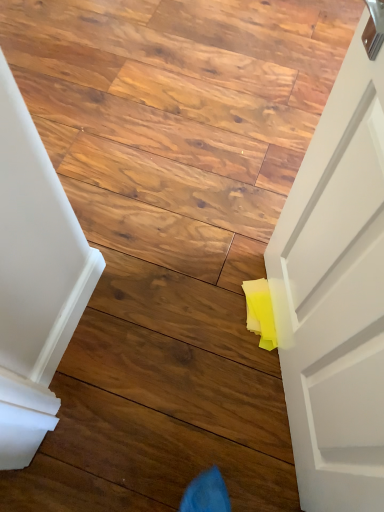
Question: From the image's perspective, is smooth wood plank at center positioned above or below yellow paper at lower right?

Choices:
 (A) above
 (B) below

Answer: (B)

Question: Is smooth wood plank at center in front of or behind yellow paper at lower right in the image?

Choices:
 (A) front
 (B) behind

Answer: (A)

Question: Do you think smooth wood plank at center is within yellow paper at lower right, or outside of it?

Choices:
 (A) outside
 (B) inside

Answer: (A)

Question: In terms of width, does yellow paper at lower right look wider or thinner when compared to smooth wood plank at center?

Choices:
 (A) thin
 (B) wide

Answer: (B)

Question: Is yellow paper at lower right bigger or smaller than smooth wood plank at center?

Choices:
 (A) small
 (B) big

Answer: (B)

Question: In the image, is yellow paper at lower right positioned in front of or behind smooth wood plank at center?

Choices:
 (A) front
 (B) behind

Answer: (B)

Question: Is yellow paper at lower right spatially inside smooth wood plank at center, or outside of it?

Choices:
 (A) inside
 (B) outside

Answer: (B)